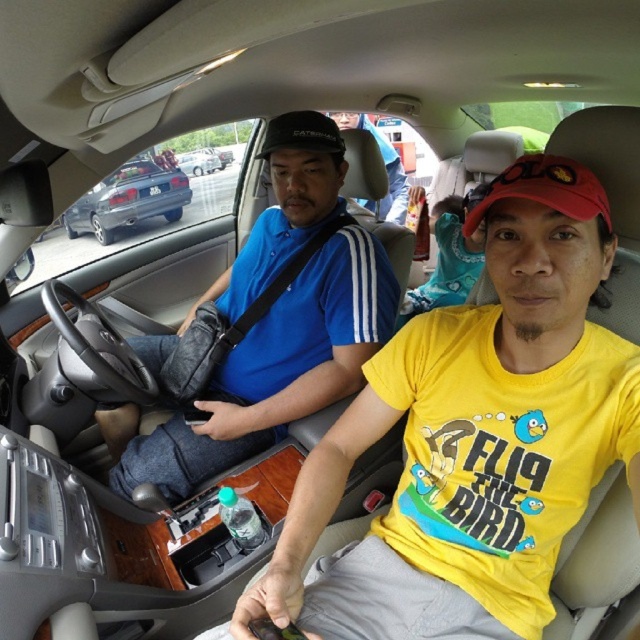
Does point (113, 189) come behind point (397, 186)?

Yes, point (113, 189) is farther from viewer.

Between point (147, 212) and point (388, 195), which one is positioned in front?

Point (388, 195) is more forward.

I want to click on metallic blue minivan at left, so click(129, 200).

Based on the photo, between yellow matte t-shirt at center and matte blue shirt at center, which one appears on the right side from the viewer's perspective?

From the viewer's perspective, matte blue shirt at center appears more on the right side.

Describe the element at coordinates (474, 438) in the screenshot. I see `yellow matte t-shirt at center` at that location.

Where is `yellow matte t-shirt at center`? This screenshot has width=640, height=640. yellow matte t-shirt at center is located at coordinates (474, 438).

Is metallic blue minivan at left above clear plastic bottle at center?

Yes, metallic blue minivan at left is above clear plastic bottle at center.

Which is behind, point (172, 193) or point (252, 506)?

Point (172, 193)

Which is behind, point (156, 193) or point (260, 518)?

Positioned behind is point (156, 193).

I want to click on metallic blue minivan at left, so click(129, 200).